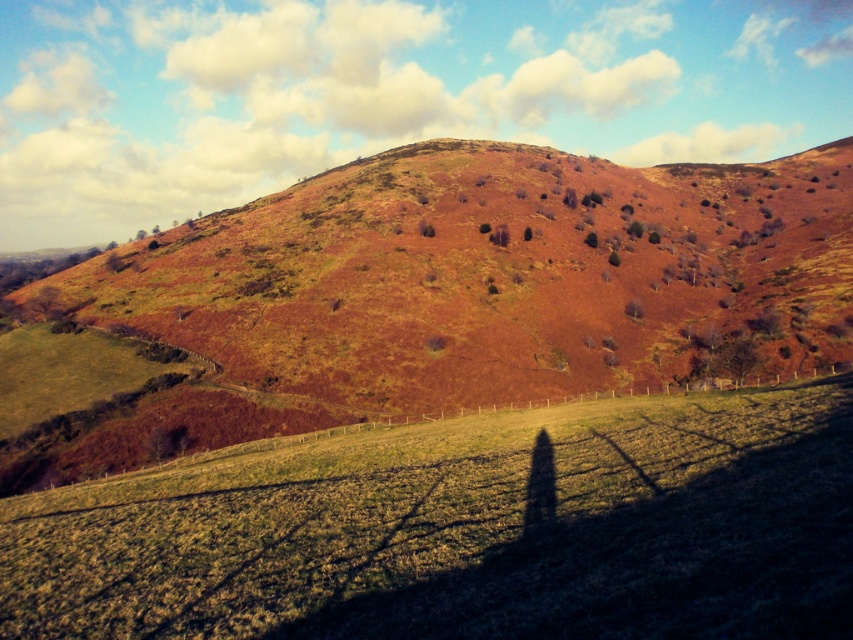
Question: Which object appears closest to the camera in this image?

Choices:
 (A) brown rough tree at upper center
 (B) green matte tree at center
 (C) green grassy field at lower center
 (D) brown grassy hillside at center

Answer: (C)

Question: Which point is closer to the camera taking this photo?

Choices:
 (A) (587, 234)
 (B) (635, 234)
 (C) (527, 564)
 (D) (705, 289)

Answer: (C)

Question: Does brown grassy hillside at center come in front of brown rough tree at upper center?

Choices:
 (A) yes
 (B) no

Answer: (A)

Question: Estimate the real-world distances between objects in this image. Which object is closer to the brown rough tree at upper center?

Choices:
 (A) green matte tree at upper center
 (B) brown grassy hillside at center
 (C) green grassy field at lower center
 (D) green matte tree at center

Answer: (D)

Question: Where is green grassy field at lower center located in relation to brown rough tree at upper center in the image?

Choices:
 (A) right
 (B) left

Answer: (B)

Question: Does brown grassy hillside at center have a smaller size compared to green grassy field at lower center?

Choices:
 (A) yes
 (B) no

Answer: (B)